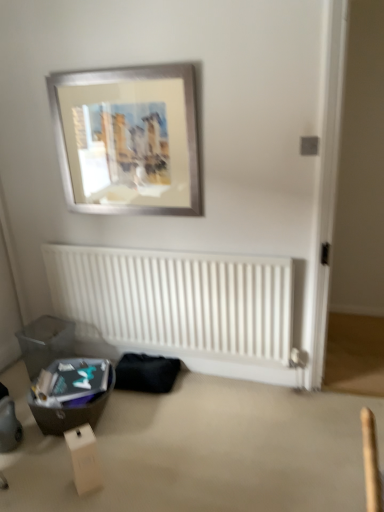
The image size is (384, 512). Identify the location of white cardboard box at lower left. (84, 459).

Describe the element at coordinates (128, 139) in the screenshot. I see `silver metallic picture frame at upper center` at that location.

What do you see at coordinates (71, 410) in the screenshot?
I see `matte black storage box at lower left, which is the second storage box from back to front` at bounding box center [71, 410].

I want to click on white cardboard box at lower left, so click(x=84, y=459).

From the image's perspective, which object appears higher, matte black storage box at lower left, marked as the 1th storage box in a front-to-back arrangement, or translucent plastic storage box at lower left, the first storage box viewed from the back?

translucent plastic storage box at lower left, the first storage box viewed from the back, from the image's perspective.

Considering the points (102, 399) and (47, 329), which point is in front, point (102, 399) or point (47, 329)?

The point (102, 399) is closer to the camera.

Is matte black storage box at lower left, which is the second storage box from back to front, further to camera compared to translucent plastic storage box at lower left, which is the second storage box in front-to-back order?

No, matte black storage box at lower left, which is the second storage box from back to front, is closer to the viewer.

Can you confirm if matte black storage box at lower left, which is the second storage box from back to front, is thinner than translucent plastic storage box at lower left, the first storage box viewed from the back?

Incorrect, the width of matte black storage box at lower left, which is the second storage box from back to front, is not less than that of translucent plastic storage box at lower left, the first storage box viewed from the back.

Looking at this image, from the image's perspective, which is below, white cardboard box at lower left or white matte radiator at lower center?

From the image's view, white cardboard box at lower left is below.

Is white cardboard box at lower left next to white matte radiator at lower center and touching it?

They are not placed beside each other.

Looking at this image, does white cardboard box at lower left come in front of white matte radiator at lower center?

Yes, the depth of white cardboard box at lower left is less than that of white matte radiator at lower center.

Is white cardboard box at lower left far from translucent plastic storage box at lower left, which is the second storage box in front-to-back order?

Yes.

Who is shorter, white cardboard box at lower left or translucent plastic storage box at lower left, which is the second storage box in front-to-back order?

With less height is white cardboard box at lower left.

Can you tell me how much white cardboard box at lower left and translucent plastic storage box at lower left, which is the second storage box in front-to-back order, differ in facing direction?

They differ by 32.1 degrees in their facing directions.

Does white cardboard box at lower left appear on the left side of translucent plastic storage box at lower left, the first storage box viewed from the back?

In fact, white cardboard box at lower left is to the right of translucent plastic storage box at lower left, the first storage box viewed from the back.

Considering the relative sizes of white matte radiator at lower center and white cardboard box at lower left in the image provided, is white matte radiator at lower center wider than white cardboard box at lower left?

In fact, white matte radiator at lower center might be narrower than white cardboard box at lower left.

Considering the relative sizes of white matte radiator at lower center and white cardboard box at lower left in the image provided, is white matte radiator at lower center bigger than white cardboard box at lower left?

Yes, white matte radiator at lower center is bigger than white cardboard box at lower left.

Is white matte radiator at lower center inside or outside of white cardboard box at lower left?

white matte radiator at lower center is outside white cardboard box at lower left.

Is point (164, 260) farther from camera compared to point (86, 478)?

Yes.

Find the location of a particular element. picture frame on the right of matte black storage box at lower left, which is the second storage box from back to front is located at coordinates (128, 139).

Between silver metallic picture frame at upper center and matte black storage box at lower left, which is the second storage box from back to front, which one has more height?

silver metallic picture frame at upper center.

Is point (79, 202) farther from viewer compared to point (96, 424)?

Yes, it is behind point (96, 424).

Which is correct: silver metallic picture frame at upper center is inside matte black storage box at lower left, which is the second storage box from back to front, or outside of it?

silver metallic picture frame at upper center is not enclosed by matte black storage box at lower left, which is the second storage box from back to front.

Is point (45, 327) closer to viewer compared to point (81, 487)?

No.

Does translucent plastic storage box at lower left, the first storage box viewed from the back, lie behind white cardboard box at lower left?

Yes, it is behind white cardboard box at lower left.

In terms of width, does translucent plastic storage box at lower left, which is the second storage box in front-to-back order, look wider or thinner when compared to white cardboard box at lower left?

In the image, translucent plastic storage box at lower left, which is the second storage box in front-to-back order, appears to be wider than white cardboard box at lower left.

From a real-world perspective, is matte black storage box at lower left, marked as the 1th storage box in a front-to-back arrangement, above or below white matte radiator at lower center?

From a real-world perspective, matte black storage box at lower left, marked as the 1th storage box in a front-to-back arrangement, is physically below white matte radiator at lower center.

Considering the positions of objects matte black storage box at lower left, marked as the 1th storage box in a front-to-back arrangement, and white matte radiator at lower center in the image provided, who is more to the left, matte black storage box at lower left, marked as the 1th storage box in a front-to-back arrangement, or white matte radiator at lower center?

Positioned to the left is matte black storage box at lower left, marked as the 1th storage box in a front-to-back arrangement.

Is matte black storage box at lower left, marked as the 1th storage box in a front-to-back arrangement, spatially inside white matte radiator at lower center, or outside of it?

matte black storage box at lower left, marked as the 1th storage box in a front-to-back arrangement, cannot be found inside white matte radiator at lower center.

Identify the location of storage box on the left of matte black storage box at lower left, which is the second storage box from back to front. The width and height of the screenshot is (384, 512). (44, 341).

Find the location of a particular element. This screenshot has height=512, width=384. cardboard box located below the white matte radiator at lower center (from the image's perspective) is located at coordinates (84, 459).

Based on their spatial positions, is silver metallic picture frame at upper center or white matte radiator at lower center further from translucent plastic storage box at lower left, the first storage box viewed from the back?

Among the two, silver metallic picture frame at upper center is located further to translucent plastic storage box at lower left, the first storage box viewed from the back.

Considering their positions, is matte black storage box at lower left, which is the second storage box from back to front, positioned further to translucent plastic storage box at lower left, which is the second storage box in front-to-back order, than white cardboard box at lower left?

white cardboard box at lower left is further to translucent plastic storage box at lower left, which is the second storage box in front-to-back order.

When comparing their distances from white cardboard box at lower left, does white matte radiator at lower center or translucent plastic storage box at lower left, the first storage box viewed from the back, seem closer?

white matte radiator at lower center.

Considering their positions, is silver metallic picture frame at upper center positioned closer to white matte radiator at lower center than white cardboard box at lower left?

silver metallic picture frame at upper center is positioned closer to the anchor white matte radiator at lower center.

Looking at the image, which one is located further to translucent plastic storage box at lower left, which is the second storage box in front-to-back order, white matte radiator at lower center or matte black storage box at lower left, marked as the 1th storage box in a front-to-back arrangement?

Among the two, white matte radiator at lower center is located further to translucent plastic storage box at lower left, which is the second storage box in front-to-back order.

Based on their spatial positions, is matte black storage box at lower left, which is the second storage box from back to front, or white cardboard box at lower left further from white matte radiator at lower center?

Based on the image, white cardboard box at lower left appears to be further to white matte radiator at lower center.

Which object lies further to the anchor point white matte radiator at lower center, translucent plastic storage box at lower left, the first storage box viewed from the back, or silver metallic picture frame at upper center?

silver metallic picture frame at upper center is further to white matte radiator at lower center.

Looking at this image, based on their spatial positions, is white cardboard box at lower left or white matte radiator at lower center further from matte black storage box at lower left, marked as the 1th storage box in a front-to-back arrangement?

Among the two, white matte radiator at lower center is located further to matte black storage box at lower left, marked as the 1th storage box in a front-to-back arrangement.

Locate an element on the screen. This screenshot has height=512, width=384. storage box between silver metallic picture frame at upper center and matte black storage box at lower left, which is the second storage box from back to front, in the up-down direction is located at coordinates (44, 341).

Locate an element on the screen. This screenshot has width=384, height=512. storage box between white cardboard box at lower left and translucent plastic storage box at lower left, which is the second storage box in front-to-back order, along the z-axis is located at coordinates (71, 410).

Identify the location of radiator between white cardboard box at lower left and translucent plastic storage box at lower left, which is the second storage box in front-to-back order, from front to back. (177, 300).

Identify the location of radiator between silver metallic picture frame at upper center and translucent plastic storage box at lower left, the first storage box viewed from the back, in the up-down direction. (177, 300).